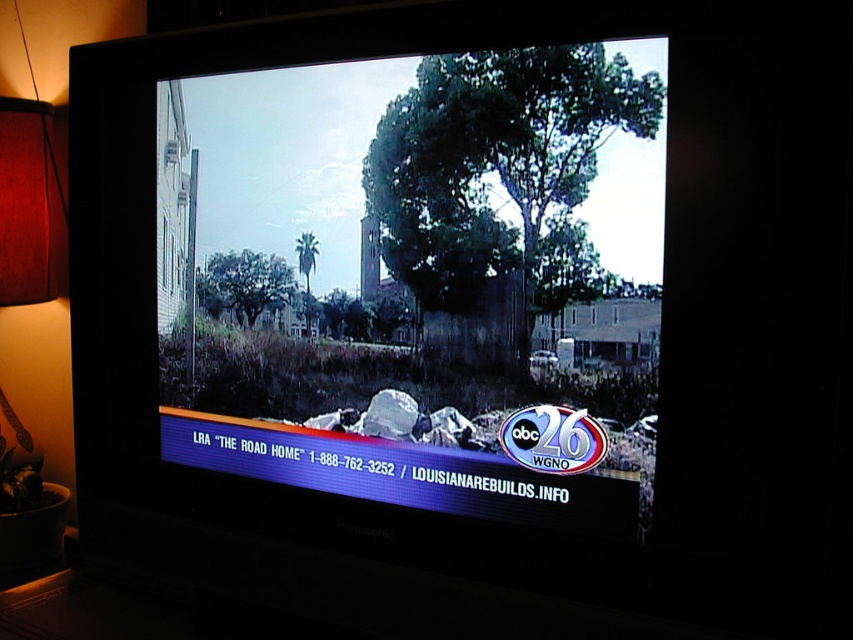
Question: Where is matte black television at center located in relation to wooden lampshade at left in the image?

Choices:
 (A) above
 (B) below

Answer: (A)

Question: Does matte black television at center appear over wooden lampshade at left?

Choices:
 (A) yes
 (B) no

Answer: (A)

Question: Which object is farther from the camera taking this photo?

Choices:
 (A) matte black television at center
 (B) wooden lampshade at left

Answer: (B)

Question: Observing the image, what is the correct spatial positioning of matte black television at center in reference to wooden lampshade at left?

Choices:
 (A) above
 (B) below

Answer: (A)